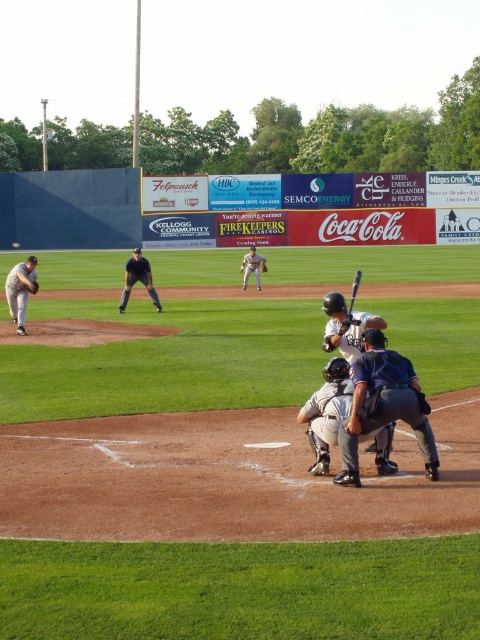
You are a spectator sitting in the stands and want to take a photo of the gray matte uniform at center and the brown leather glove at pitcher. Which object will appear larger in your photo?

The gray matte uniform at center will appear larger in the photo because it is closer to the viewer than the brown leather glove at pitcher.

You are standing at the edge of the baseball field and want to reach a specific point marked at coordinates point [376,449]. If you can walk 1.5 meters per second, how long will it take you to reach that point?

The distance of point [376,449] from viewer is 7.29 meters. At a walking speed of 1.5 meters per second, it will take approximately 4.86 seconds to reach the point.

You are a photographer standing at the edge of the field. You want to take a photo of the dark blue uniform at center. If your camera has a minimum focusing distance of 6 meters, will you be able to take a clear photo without moving closer?

The dark blue uniform at center is 6.63 meters away from the camera. Since the minimum focusing distance is 6 meters, the camera can focus on the subject as the distance is within range. Therefore, you can take a clear photo without moving closer.